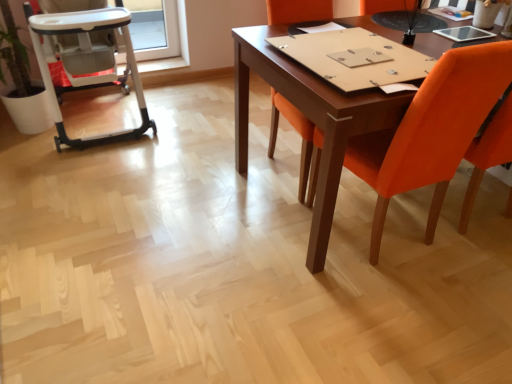
Where is `orange fabric chair at right, which ranks as the 1th chair in right-to-left order`? Image resolution: width=512 pixels, height=384 pixels. orange fabric chair at right, which ranks as the 1th chair in right-to-left order is located at coordinates (432, 131).

Describe the element at coordinates (88, 60) in the screenshot. This screenshot has width=512, height=384. I see `white plastic high chair at left` at that location.

Where is `orange fabric chair at right, the 2th chair when ordered from left to right`? The image size is (512, 384). orange fabric chair at right, the 2th chair when ordered from left to right is located at coordinates (432, 131).

From the picture: From the image's perspective, who appears lower, white plastic high chair at left or orange fabric chair at center, the 2th chair when ordered from right to left?

orange fabric chair at center, the 2th chair when ordered from right to left, is shown below in the image.

From a real-world perspective, which object rests below the other?

white plastic high chair at left, from a real-world perspective.

Is white plastic high chair at left looking in the opposite direction of orange fabric chair at center, the 2th chair when ordered from right to left?

No, white plastic high chair at left's orientation is not away from orange fabric chair at center, the 2th chair when ordered from right to left.

Is white plastic high chair at left surrounding orange fabric chair at center, acting as the first chair starting from the left?

Actually, orange fabric chair at center, acting as the first chair starting from the left, is outside white plastic high chair at left.

Is the surface of orange fabric chair at right, the 2th chair when ordered from left to right, in direct contact with orange fabric chair at center, acting as the first chair starting from the left?

No, orange fabric chair at right, the 2th chair when ordered from left to right, is not beside orange fabric chair at center, acting as the first chair starting from the left.

From the image's perspective, does orange fabric chair at right, the 2th chair when ordered from left to right, appear lower than orange fabric chair at center, the 2th chair when ordered from right to left?

Indeed, from the image's perspective, orange fabric chair at right, the 2th chair when ordered from left to right, is shown beneath orange fabric chair at center, the 2th chair when ordered from right to left.

Image resolution: width=512 pixels, height=384 pixels. Identify the location of chair above the orange fabric chair at right, which ranks as the 1th chair in right-to-left order (from a real-world perspective). (297, 131).

In the image, is orange fabric chair at right, which ranks as the 1th chair in right-to-left order, on the left side or the right side of orange fabric chair at center, acting as the first chair starting from the left?

Based on their positions, orange fabric chair at right, which ranks as the 1th chair in right-to-left order, is located to the right of orange fabric chair at center, acting as the first chair starting from the left.

Which of these two, orange fabric chair at center, the 2th chair when ordered from right to left, or white plastic high chair at left, is wider?

white plastic high chair at left is wider.

Which of these two, orange fabric chair at center, the 2th chair when ordered from right to left, or white plastic high chair at left, is bigger?

white plastic high chair at left.

Considering their positions, is orange fabric chair at center, the 2th chair when ordered from right to left, located in front of or behind white plastic high chair at left?

Visually, orange fabric chair at center, the 2th chair when ordered from right to left, is located in front of white plastic high chair at left.

Between orange fabric chair at center, acting as the first chair starting from the left, and white plastic high chair at left, which one has less height?

white plastic high chair at left.

This screenshot has width=512, height=384. What are the coordinates of `chair that is the 2nd object to the right of the white plastic high chair at left, starting at the anchor` in the screenshot? It's located at (432, 131).

Considering the relative positions of white plastic high chair at left and orange fabric chair at right, which ranks as the 1th chair in right-to-left order, in the image provided, is white plastic high chair at left to the right of orange fabric chair at right, which ranks as the 1th chair in right-to-left order, from the viewer's perspective?

No.

Does white plastic high chair at left have a lesser width compared to orange fabric chair at right, the 2th chair when ordered from left to right?

No.

Does white plastic high chair at left touch orange fabric chair at right, the 2th chair when ordered from left to right?

They are not placed beside each other.

Between orange fabric chair at center, acting as the first chair starting from the left, and orange fabric chair at right, the 2th chair when ordered from left to right, which one is positioned behind?

orange fabric chair at center, acting as the first chair starting from the left, is further away from the camera.

Between orange fabric chair at center, acting as the first chair starting from the left, and orange fabric chair at right, the 2th chair when ordered from left to right, which one appears on the right side from the viewer's perspective?

orange fabric chair at right, the 2th chair when ordered from left to right.

From a real-world perspective, relative to orange fabric chair at right, the 2th chair when ordered from left to right, is orange fabric chair at center, the 2th chair when ordered from right to left, vertically above or below?

orange fabric chair at center, the 2th chair when ordered from right to left, is above orange fabric chair at right, the 2th chair when ordered from left to right.

Between orange fabric chair at center, acting as the first chair starting from the left, and orange fabric chair at right, which ranks as the 1th chair in right-to-left order, which one has smaller size?

With smaller size is orange fabric chair at right, which ranks as the 1th chair in right-to-left order.

Could you tell me if orange fabric chair at right, which ranks as the 1th chair in right-to-left order, is turned towards white plastic high chair at left?

No, orange fabric chair at right, which ranks as the 1th chair in right-to-left order, does not turn towards white plastic high chair at left.

How much distance is there between orange fabric chair at right, the 2th chair when ordered from left to right, and white plastic high chair at left?

They are 5.25 feet apart.

Considering the relative positions of orange fabric chair at right, which ranks as the 1th chair in right-to-left order, and white plastic high chair at left in the image provided, is orange fabric chair at right, which ranks as the 1th chair in right-to-left order, to the right of white plastic high chair at left from the viewer's perspective?

Yes, orange fabric chair at right, which ranks as the 1th chair in right-to-left order, is to the right of white plastic high chair at left.

Relative to white plastic high chair at left, is orange fabric chair at right, which ranks as the 1th chair in right-to-left order, in front or behind?

orange fabric chair at right, which ranks as the 1th chair in right-to-left order, is positioned closer to the viewer than white plastic high chair at left.

Locate an element on the screen. armchair lying on the left of orange fabric chair at center, the 2th chair when ordered from right to left is located at coordinates point(88,60).

At what (x,y) coordinates should I click in order to perform the action: click on chair on the right of orange fabric chair at center, acting as the first chair starting from the left. Please return your answer as a coordinate pair (x, y). This screenshot has width=512, height=384. Looking at the image, I should click on (432, 131).

Looking at the image, which one is located further to white plastic high chair at left, orange fabric chair at center, the 2th chair when ordered from right to left, or orange fabric chair at right, which ranks as the 1th chair in right-to-left order?

orange fabric chair at right, which ranks as the 1th chair in right-to-left order, lies further to white plastic high chair at left than the other object.

Looking at the image, which one is located further to orange fabric chair at center, acting as the first chair starting from the left, orange fabric chair at right, the 2th chair when ordered from left to right, or white plastic high chair at left?

white plastic high chair at left is further to orange fabric chair at center, acting as the first chair starting from the left.

Which object lies further to the anchor point orange fabric chair at right, the 2th chair when ordered from left to right, white plastic high chair at left or orange fabric chair at center, acting as the first chair starting from the left?

white plastic high chair at left is further to orange fabric chair at right, the 2th chair when ordered from left to right.

From the image, which object appears to be farther from white plastic high chair at left, orange fabric chair at right, which ranks as the 1th chair in right-to-left order, or orange fabric chair at center, the 2th chair when ordered from right to left?

orange fabric chair at right, which ranks as the 1th chair in right-to-left order, lies further to white plastic high chair at left than the other object.

Estimate the real-world distances between objects in this image. Which object is further from orange fabric chair at right, the 2th chair when ordered from left to right, orange fabric chair at center, acting as the first chair starting from the left, or white plastic high chair at left?

The object further to orange fabric chair at right, the 2th chair when ordered from left to right, is white plastic high chair at left.

When comparing their distances from orange fabric chair at center, the 2th chair when ordered from right to left, does white plastic high chair at left or orange fabric chair at right, which ranks as the 1th chair in right-to-left order, seem further?

white plastic high chair at left is further to orange fabric chair at center, the 2th chair when ordered from right to left.

Find the location of a particular element. chair located between white plastic high chair at left and orange fabric chair at right, the 2th chair when ordered from left to right, in the left-right direction is located at coordinates (297, 131).